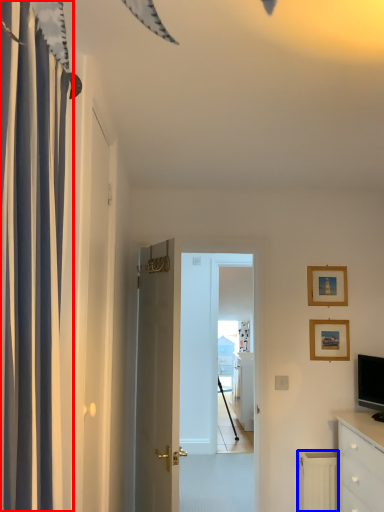
Question: Among these objects, which one is farthest to the camera, curtain (highlighted by a red box) or radiator (highlighted by a blue box)?

Choices:
 (A) curtain
 (B) radiator

Answer: (B)